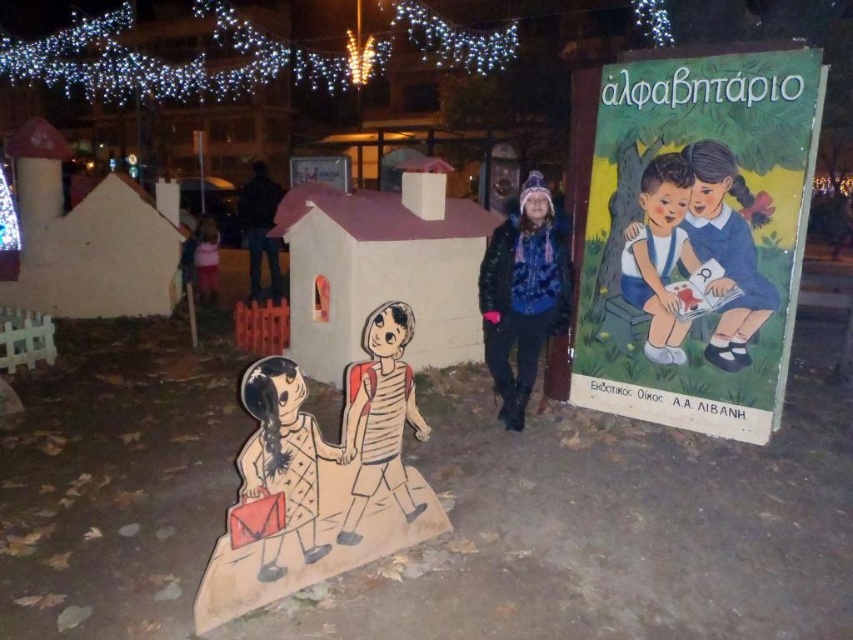
Question: Which point appears closest to the camera in this image?

Choices:
 (A) (254, 292)
 (B) (654, 211)

Answer: (B)

Question: Is illuminated string lights at upper center positioned behind matte cardboard figure at center?

Choices:
 (A) yes
 (B) no

Answer: (A)

Question: Observing the image, what is the correct spatial positioning of matte paper poster at upper right in reference to matte cardboard figure at center?

Choices:
 (A) left
 (B) right

Answer: (B)

Question: Among these points, which one is nearest to the camera?

Choices:
 (A) [x=514, y=387]
 (B) [x=688, y=182]
 (C) [x=630, y=374]
 (D) [x=369, y=440]

Answer: (D)

Question: Does matte paper poster at upper right appear over matte cardboard figure at center?

Choices:
 (A) yes
 (B) no

Answer: (A)

Question: Which object is positioned farthest from the matte paper poster at upper right?

Choices:
 (A) black leather jacket at center
 (B) illuminated string lights at upper center
 (C) matte cardboard figure at center

Answer: (B)